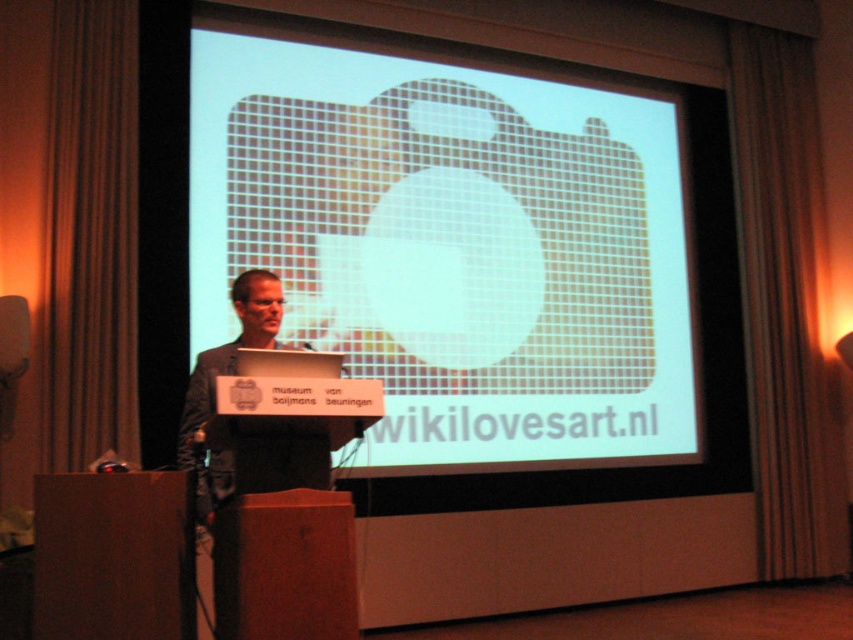
You are an attendee at the presentation and want to take a photo of the dark gray suit at center and the white mesh screen at center. Which object is closer to you?

The white mesh screen at center is closer to you than the dark gray suit at center.

You are an attendee at the presentation and want to see both the speaker and the laptop. Since you can only look in one direction, which direction should you look to see both the white mesh screen at center and the matte black laptop at center?

You should look to the left of the white mesh screen at center because the matte black laptop at center is positioned to the left of it, allowing you to see both objects in that direction.

You are an event organizer who needs to ensure there is enough space between the dark gray suit at center and the matte black laptop at center for the presenter to move comfortably. According to the guidelines, the minimum required distance is 18 inches. Can the presenter move comfortably between them?

The dark gray suit at center is 17.45 inches from the matte black laptop at center. Since the minimum required distance is 18 inches, the presenter does not have enough space to move comfortably between them.